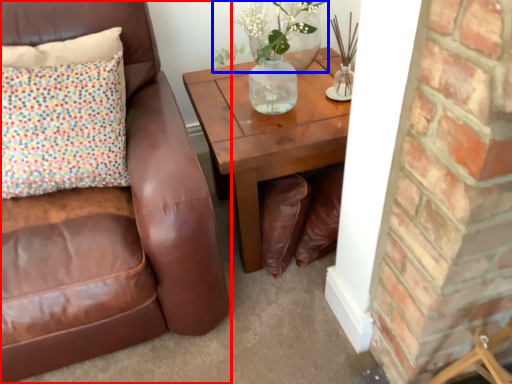
Question: Among these objects, which one is farthest to the camera, chair (highlighted by a red box) or floral arrangement (highlighted by a blue box)?

Choices:
 (A) chair
 (B) floral arrangement

Answer: (B)